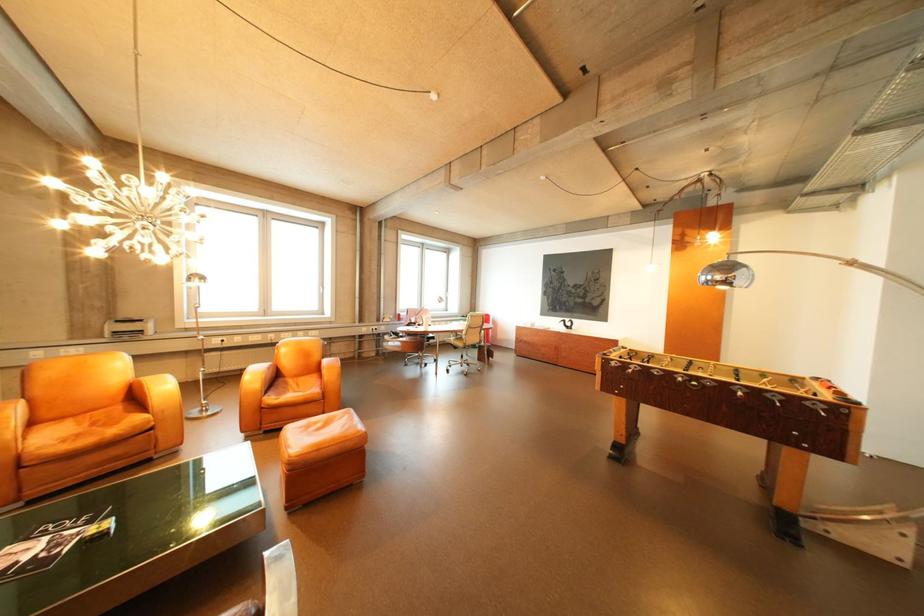
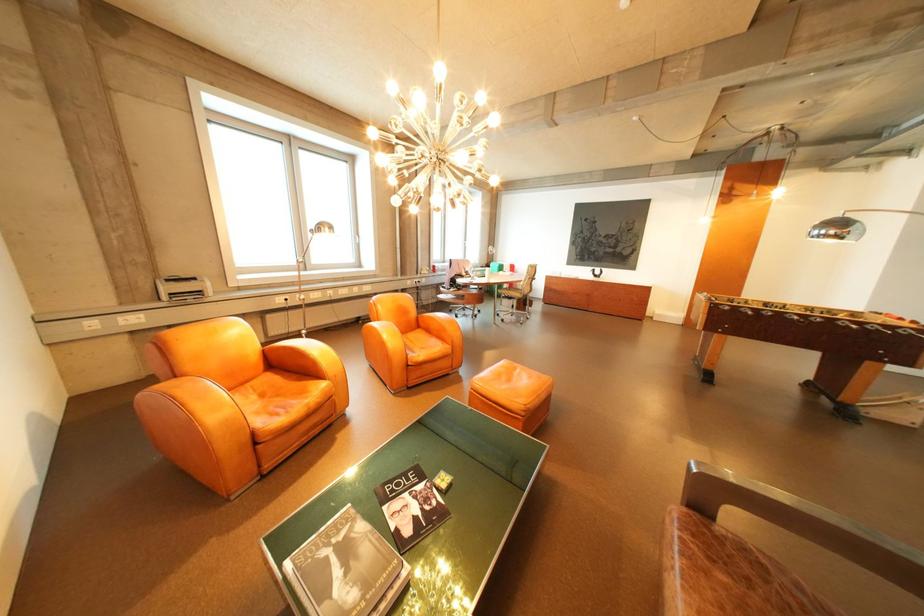
The point at (732, 278) is marked in the first image. Where is the corresponding point in the second image?

(846, 233)